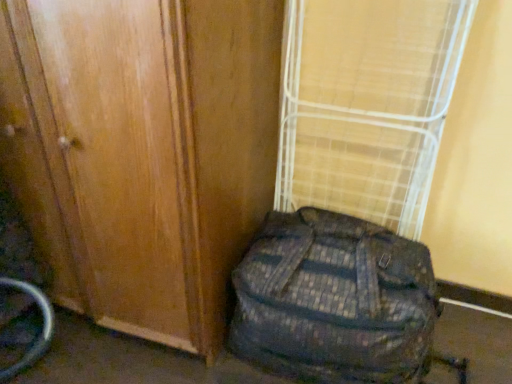
Identify the location of wooden door at center. (143, 152).

Is bamboo mat at center not near camouflage fabric backpack at lower right?

They are positioned close to each other.

Is bamboo mat at center at the left side of camouflage fabric backpack at lower right?

No, bamboo mat at center is not to the left of camouflage fabric backpack at lower right.

Is bamboo mat at center closer to the viewer compared to camouflage fabric backpack at lower right?

No, it is not.

Does bamboo mat at center turn towards camouflage fabric backpack at lower right?

Yes, bamboo mat at center faces towards camouflage fabric backpack at lower right.

How many degrees apart are the facing directions of bamboo mat at center and wooden door at center?

The angular difference between bamboo mat at center and wooden door at center is 0.435 degrees.

Considering the relative sizes of bamboo mat at center and wooden door at center in the image provided, is bamboo mat at center smaller than wooden door at center?

Correct, bamboo mat at center occupies less space than wooden door at center.

Considering the relative sizes of bamboo mat at center and wooden door at center in the image provided, is bamboo mat at center shorter than wooden door at center?

Yes, bamboo mat at center is shorter than wooden door at center.

From the image's perspective, which is above, wooden door at center or bamboo mat at center?

bamboo mat at center appears higher in the image.

Relative to bamboo mat at center, is wooden door at center in front or behind?

Visually, wooden door at center is located in front of bamboo mat at center.

Is bamboo mat at center at the back of wooden door at center?

wooden door at center does not have its back to bamboo mat at center.

Which is correct: wooden door at center is inside bamboo mat at center, or outside of it?

wooden door at center exists outside the volume of bamboo mat at center.

Which object is wider, camouflage fabric backpack at lower right or wooden door at center?

wooden door at center.

From the picture: Relative to wooden door at center, is camouflage fabric backpack at lower right in front or behind?

Visually, camouflage fabric backpack at lower right is located behind wooden door at center.

From the image's perspective, is camouflage fabric backpack at lower right located above wooden door at center?

Incorrect, from the image's perspective, camouflage fabric backpack at lower right is lower than wooden door at center.

Looking at this image, considering the positions of objects camouflage fabric backpack at lower right and wooden door at center in the image provided, who is more to the left, camouflage fabric backpack at lower right or wooden door at center?

Positioned to the left is wooden door at center.

Considering the points (270, 244) and (424, 203), which point is in front, point (270, 244) or point (424, 203)?

The point (270, 244) is closer to the camera.

Which of these two, camouflage fabric backpack at lower right or bamboo mat at center, is wider?

camouflage fabric backpack at lower right is wider.

Is camouflage fabric backpack at lower right not near bamboo mat at center?

No, camouflage fabric backpack at lower right is not far from bamboo mat at center.

From a real-world perspective, relative to bamboo mat at center, is camouflage fabric backpack at lower right vertically above or below?

In terms of real-world spatial position, camouflage fabric backpack at lower right is below bamboo mat at center.

Does point (257, 218) come in front of point (294, 252)?

No, (257, 218) is behind (294, 252).

Does wooden door at center have a larger size compared to camouflage fabric backpack at lower right?

Yes, wooden door at center is bigger than camouflage fabric backpack at lower right.

Between wooden door at center and camouflage fabric backpack at lower right, which one appears on the right side from the viewer's perspective?

camouflage fabric backpack at lower right.

Does wooden door at center have a lesser height compared to camouflage fabric backpack at lower right?

No.

The height and width of the screenshot is (384, 512). What are the coordinates of `curtain lying on the right of camouflage fabric backpack at lower right` in the screenshot? It's located at (366, 104).

Identify the location of door below the bamboo mat at center (from a real-world perspective). The height and width of the screenshot is (384, 512). (143, 152).

Estimate the real-world distances between objects in this image. Which object is closer to bamboo mat at center, camouflage fabric backpack at lower right or wooden door at center?

camouflage fabric backpack at lower right lies closer to bamboo mat at center than the other object.

When comparing their distances from camouflage fabric backpack at lower right, does wooden door at center or bamboo mat at center seem closer?

The object closer to camouflage fabric backpack at lower right is wooden door at center.

In the scene shown: Considering their positions, is camouflage fabric backpack at lower right positioned further to wooden door at center than bamboo mat at center?

bamboo mat at center is positioned further to the anchor wooden door at center.

Estimate the real-world distances between objects in this image. Which object is closer to bamboo mat at center, wooden door at center or camouflage fabric backpack at lower right?

camouflage fabric backpack at lower right is positioned closer to the anchor bamboo mat at center.

Which object lies further to the anchor point camouflage fabric backpack at lower right, bamboo mat at center or wooden door at center?

bamboo mat at center is further to camouflage fabric backpack at lower right.

When comparing their distances from wooden door at center, does bamboo mat at center or camouflage fabric backpack at lower right seem further?

Among the two, bamboo mat at center is located further to wooden door at center.

Image resolution: width=512 pixels, height=384 pixels. Identify the location of backpack between wooden door at center and bamboo mat at center in the horizontal direction. [x=335, y=301].